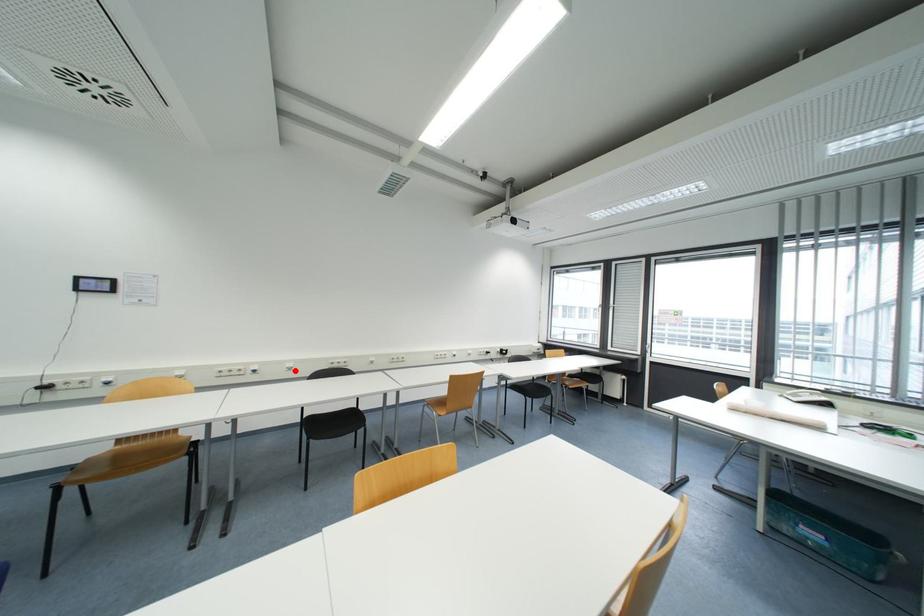
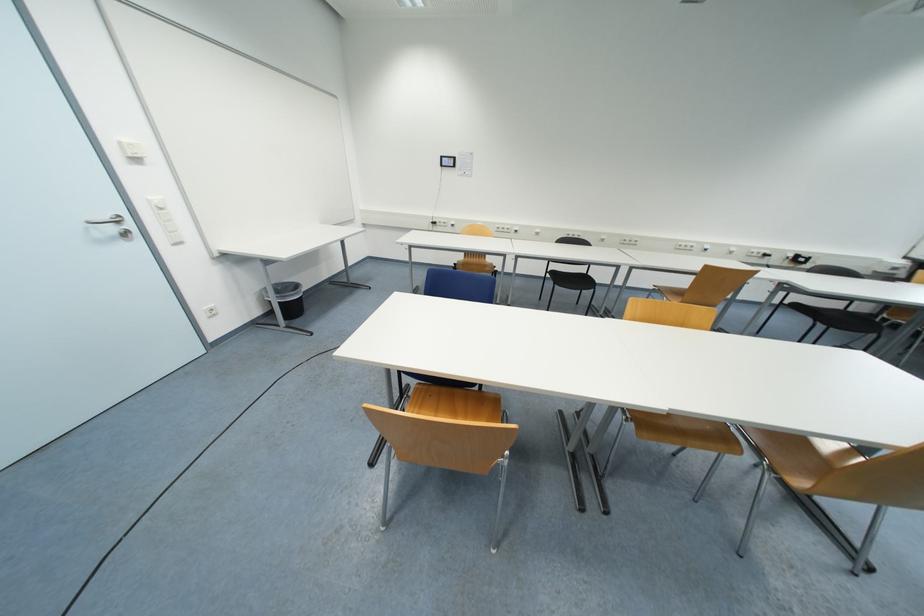
Question: I am providing you with two images of the same scene from different viewpoints. Given a red point in image1, look at the same physical point in image2. Is it:

Choices:
 (A) Closer to the viewpoint
 (B) Farther from the viewpoint

Answer: (A)